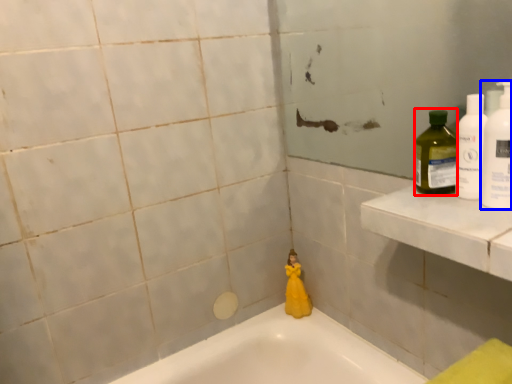
Question: Among these objects, which one is nearest to the camera, cleaning product (highlighted by a red box) or cleaning product (highlighted by a blue box)?

Choices:
 (A) cleaning product
 (B) cleaning product

Answer: (B)